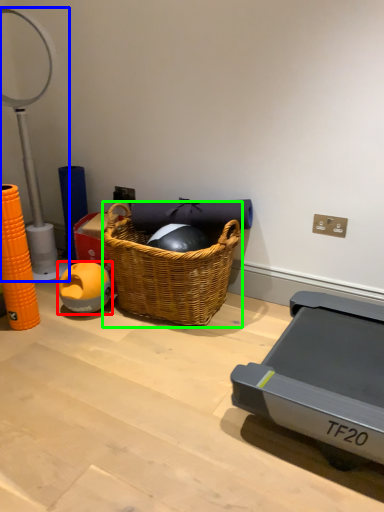
Question: Estimate the real-world distances between objects in this image. Which object is closer to ball (highlighted by a red box), table lamp (highlighted by a blue box) or picnic basket (highlighted by a green box)?

Choices:
 (A) table lamp
 (B) picnic basket

Answer: (B)